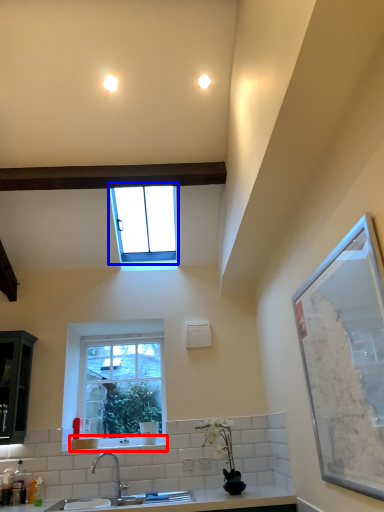
Question: Which object is further to the camera taking this photo, window sill (highlighted by a red box) or window (highlighted by a blue box)?

Choices:
 (A) window sill
 (B) window

Answer: (A)